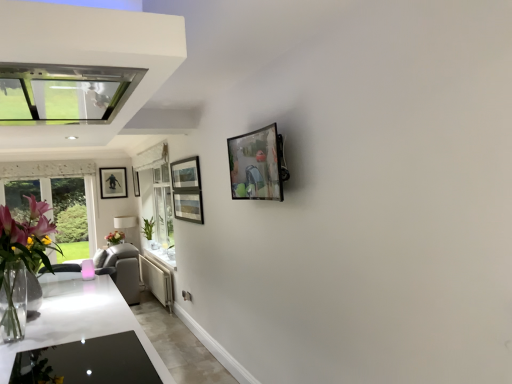
Question: Is matte white lampshade at center closer to camera compared to green leafy plant at lower left?

Choices:
 (A) no
 (B) yes

Answer: (A)

Question: Can you confirm if matte white lampshade at center is wider than green leafy plant at lower left?

Choices:
 (A) yes
 (B) no

Answer: (A)

Question: Are matte white lampshade at center and green leafy plant at lower left far apart?

Choices:
 (A) no
 (B) yes

Answer: (A)

Question: From the image's perspective, is matte white lampshade at center on top of green leafy plant at lower left?

Choices:
 (A) yes
 (B) no

Answer: (B)

Question: Is matte white lampshade at center bigger than green leafy plant at lower left?

Choices:
 (A) no
 (B) yes

Answer: (B)

Question: In the image, is metallic glass picture frame at upper center, which is the 3th picture frame in back-to-front order, positioned in front of or behind white glossy countertop at lower left?

Choices:
 (A) behind
 (B) front

Answer: (B)

Question: From the image's perspective, is metallic glass picture frame at upper center, arranged as the 1th picture frame when viewed from the right, above or below white glossy countertop at lower left?

Choices:
 (A) above
 (B) below

Answer: (A)

Question: Is metallic glass picture frame at upper center, the third picture frame in the left-to-right sequence, wider or thinner than white glossy countertop at lower left?

Choices:
 (A) thin
 (B) wide

Answer: (A)

Question: Is metallic glass picture frame at upper center, arranged as the 1th picture frame when viewed from the right, inside or outside of white glossy countertop at lower left?

Choices:
 (A) outside
 (B) inside

Answer: (A)

Question: Relative to matte black picture frame at left, the first picture frame in the back-to-front sequence, is clear glass vase at left in front or behind?

Choices:
 (A) behind
 (B) front

Answer: (B)

Question: In terms of width, does clear glass vase at left look wider or thinner when compared to matte black picture frame at left, which is counted as the 3th picture frame, starting from the front?

Choices:
 (A) wide
 (B) thin

Answer: (A)

Question: From a real-world perspective, is clear glass vase at left positioned above or below matte black picture frame at left, the first picture frame in the back-to-front sequence?

Choices:
 (A) below
 (B) above

Answer: (A)

Question: Does point (17, 241) appear closer or farther from the camera than point (111, 190)?

Choices:
 (A) closer
 (B) farther

Answer: (A)

Question: In the image, is clear glass vase at left on the left side or the right side of white glossy countertop at lower left?

Choices:
 (A) left
 (B) right

Answer: (B)

Question: From the image's perspective, is clear glass vase at left located above or below white glossy countertop at lower left?

Choices:
 (A) above
 (B) below

Answer: (A)